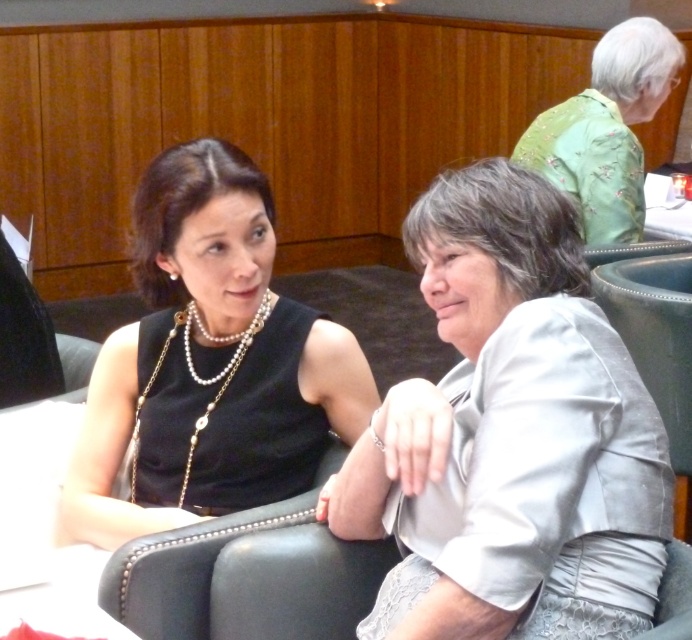
Which is in front, point (253, 372) or point (245, 346)?

Point (253, 372) is in front.

Between point (273, 300) and point (183, 346), which one is positioned behind?

The point (273, 300) is behind.

Locate an element on the screen. black satin dress at center is located at coordinates (210, 362).

Which is behind, point (248, 339) or point (689, 230)?

Positioned behind is point (689, 230).

Can you confirm if pearl/pearl-like beads necklace at upper center is positioned below white glossy table at upper right?

Yes, pearl/pearl-like beads necklace at upper center is below white glossy table at upper right.

Is point (136, 499) farther from camera compared to point (648, 209)?

No, (136, 499) is in front of (648, 209).

I want to click on pearl/pearl-like beads necklace at upper center, so click(194, 381).

Which is below, green embroidered blouse at upper right or white glossy table at upper right?

white glossy table at upper right is lower down.

Is green embroidered blouse at upper right closer to camera compared to white glossy table at upper right?

Yes, green embroidered blouse at upper right is in front of white glossy table at upper right.

Where is `green embroidered blouse at upper right`? The width and height of the screenshot is (692, 640). green embroidered blouse at upper right is located at coordinates (606, 129).

Identify the location of green embroidered blouse at upper right. Image resolution: width=692 pixels, height=640 pixels. (606, 129).